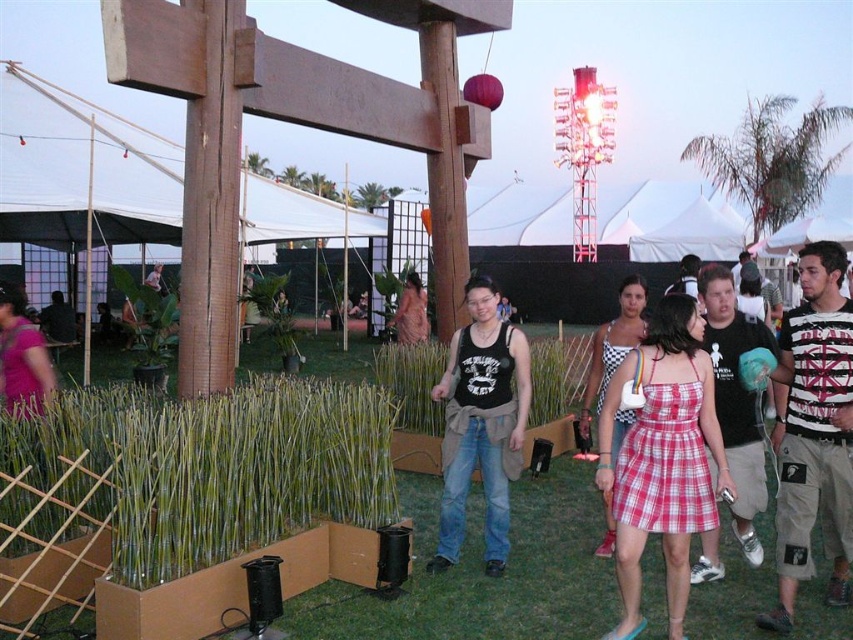
Who is taller, black cotton tank top at center or matte black tank top at center?

With more height is black cotton tank top at center.

Between point (706, 324) and point (396, 337), which one is positioned behind?

Positioned behind is point (396, 337).

You are a GUI agent. You are given a task and a screenshot of the screen. Output one action in this format:
    pyautogui.click(x=<x>, y=<y>)
    Task: Click on the black cotton tank top at center
    The image size is (853, 640).
    Given the screenshot: What is the action you would take?
    pyautogui.click(x=735, y=401)

Is point (730, 481) behind point (488, 484)?

No, it is in front of (488, 484).

Is red plaid dress at center taller than black tank top at center?

No, red plaid dress at center is not taller than black tank top at center.

Which is in front, point (613, 392) or point (495, 522)?

Point (613, 392) is in front.

You are a GUI agent. You are given a task and a screenshot of the screen. Output one action in this format:
    pyautogui.click(x=<x>, y=<y>)
    Task: Click on the red plaid dress at center
    The width and height of the screenshot is (853, 640).
    Given the screenshot: What is the action you would take?
    pyautogui.click(x=662, y=458)

Can you confirm if white fabric canopy at center is thinner than matte black tank top at center?

No, white fabric canopy at center is not thinner than matte black tank top at center.

How much distance is there between white fabric canopy at center and matte black tank top at center?

The distance of white fabric canopy at center from matte black tank top at center is 7.28 meters.

Is point (16, 157) closer to camera compared to point (405, 340)?

Yes, it is in front of point (405, 340).

Where is `white fabric canopy at center`? The image size is (853, 640). white fabric canopy at center is located at coordinates (80, 170).